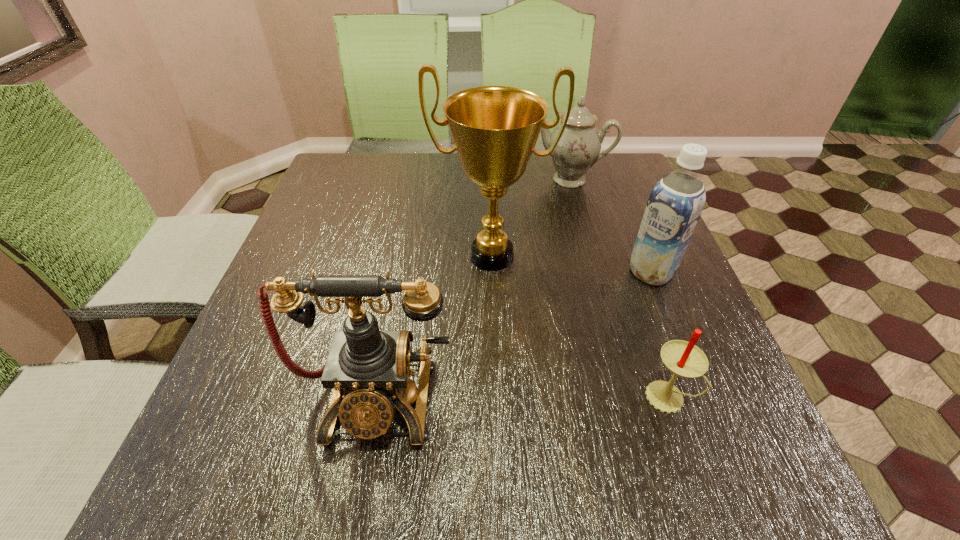
Identify the location of candle situated at the right edge. This screenshot has height=540, width=960. (684, 359).

You are a GUI agent. You are given a task and a screenshot of the screen. Output one action in this format:
    pyautogui.click(x=<x>, y=<y>)
    Task: Click on the chinaware positioned at the right edge
    
    Given the screenshot: What is the action you would take?
    pyautogui.click(x=578, y=149)

You are a GUI agent. You are given a task and a screenshot of the screen. Output one action in this format:
    pyautogui.click(x=<x>, y=<y>)
    Task: Click on the soya milk at the right edge
    
    Given the screenshot: What is the action you would take?
    pyautogui.click(x=676, y=202)

In order to click on object that is at the near left corner in this screenshot , I will do `click(368, 368)`.

I want to click on object positioned at the far right corner, so click(x=578, y=149).

You are a GUI agent. You are given a task and a screenshot of the screen. Output one action in this format:
    pyautogui.click(x=<x>, y=<y>)
    Task: Click on the object located at the near right corner
    The height and width of the screenshot is (540, 960).
    Given the screenshot: What is the action you would take?
    pyautogui.click(x=684, y=359)

Identify the location of vacant space at the far edge of the desktop. click(x=379, y=198).

In the image, there is a desktop. Where is `free space at the near edge`? This screenshot has height=540, width=960. free space at the near edge is located at coordinates (454, 405).

Where is `vacant area at the left edge of the desktop`? The width and height of the screenshot is (960, 540). vacant area at the left edge of the desktop is located at coordinates (300, 261).

At what (x,y) coordinates should I click in order to perform the action: click on vacant space at the right edge of the desktop. Please return your answer as a coordinate pair (x, y). The image size is (960, 540). Looking at the image, I should click on (683, 292).